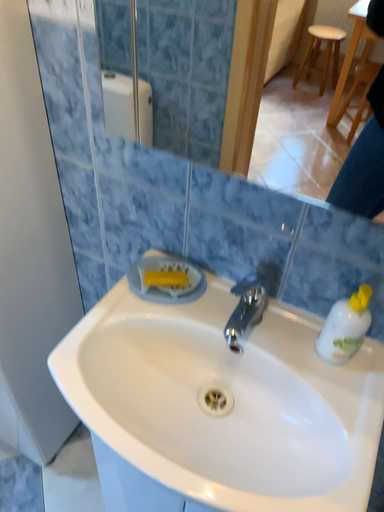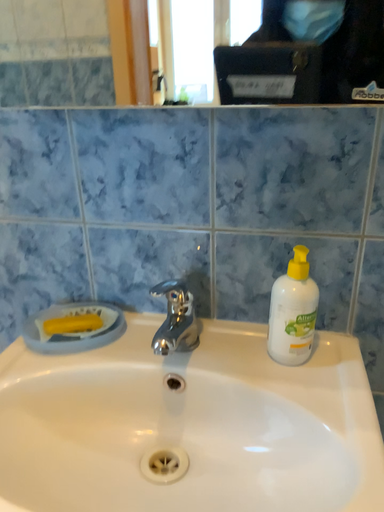
Question: How did the camera likely rotate when shooting the video?

Choices:
 (A) rotated downward
 (B) rotated upward

Answer: (B)